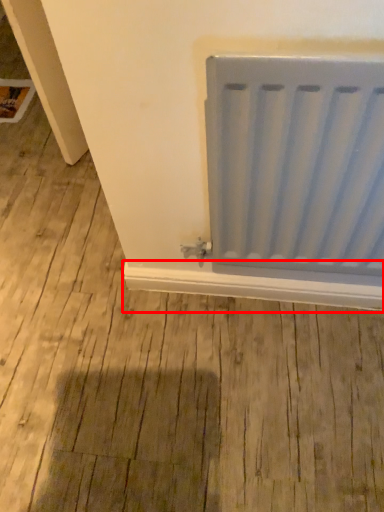
Question: Considering the relative positions of window sill (annotated by the red box) and radiator in the image provided, where is window sill (annotated by the red box) located with respect to the staircase?

Choices:
 (A) right
 (B) left

Answer: (B)